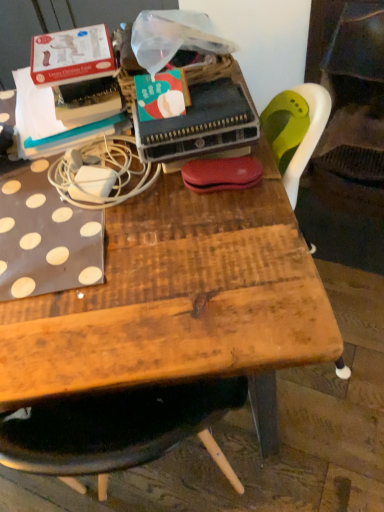
In order to click on vacant area in front of matte green paperback book at center in this screenshot , I will do `click(197, 217)`.